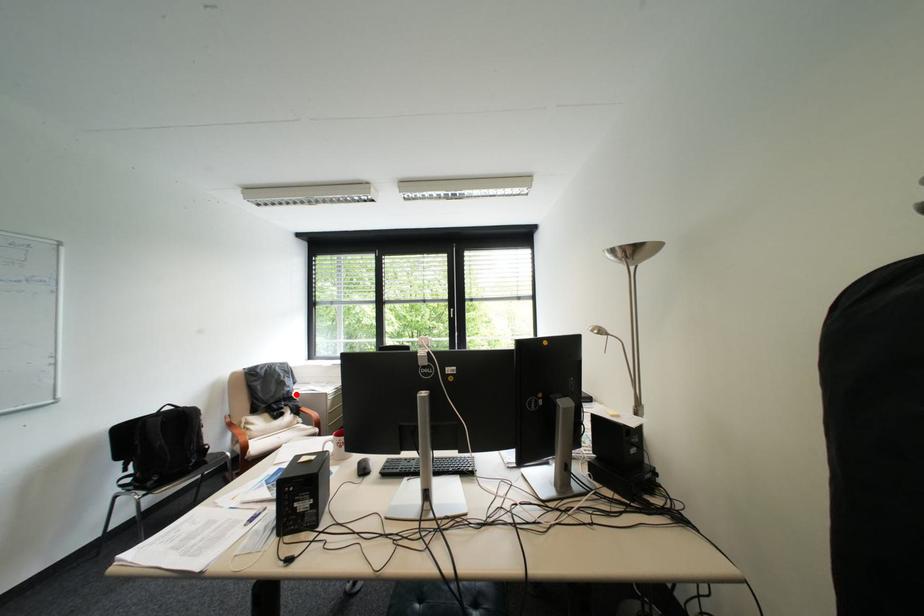
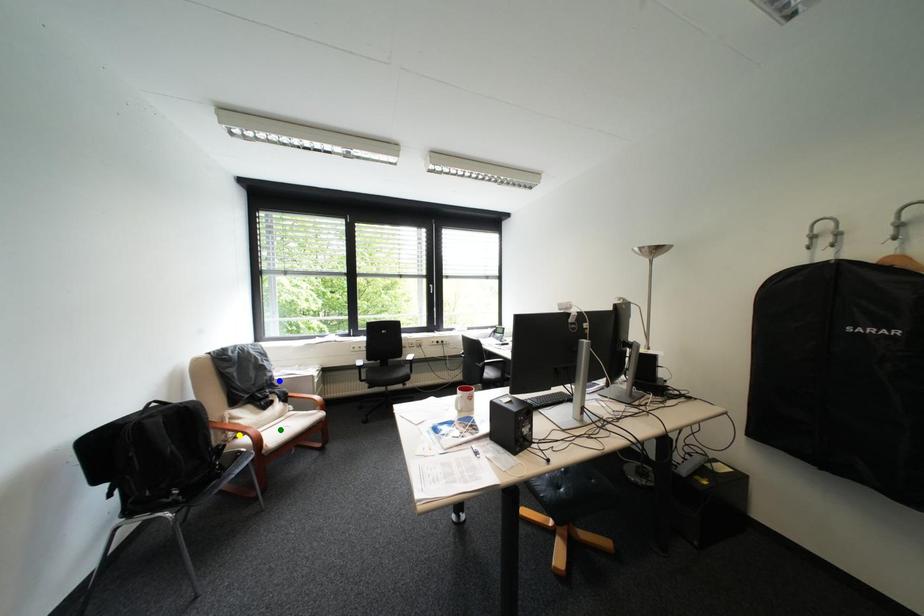
Question: I am providing you with two images of the same scene from different viewpoints. A red point is marked on the first image. You are given multiple points on the second image. Which mark in image 2 goes with the point in image 1?

Choices:
 (A) blue point
 (B) green point
 (C) yellow point

Answer: (A)